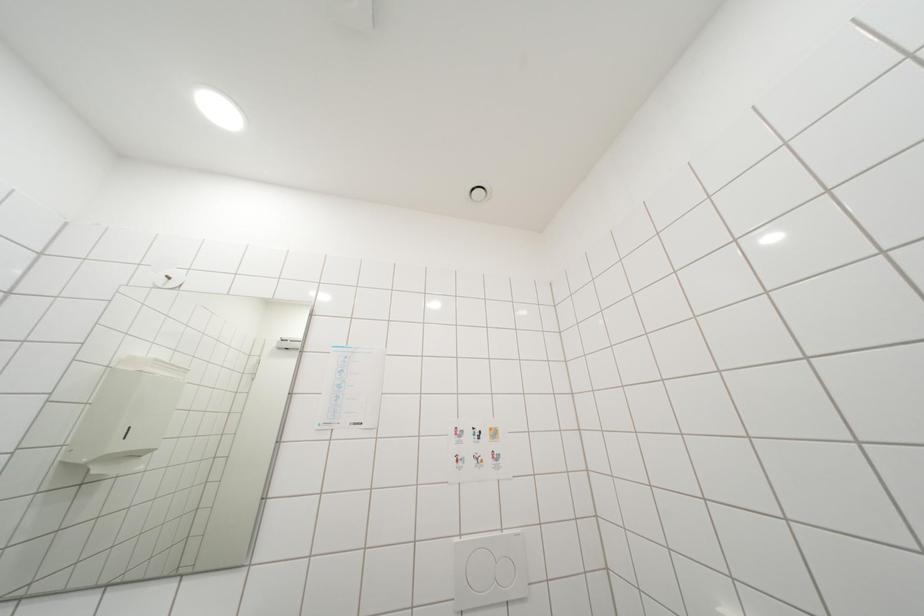
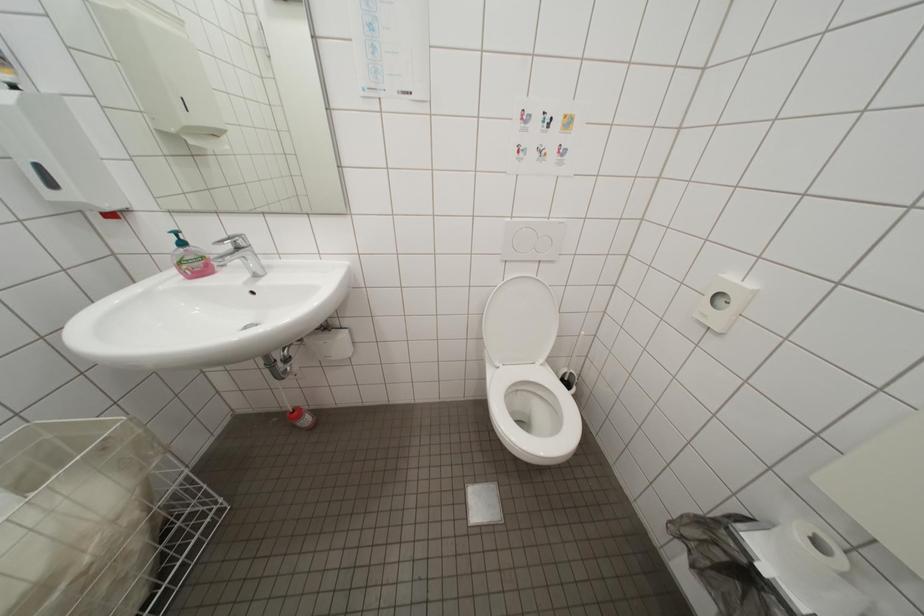
Question: The images are taken continuously from a first-person perspective. In which direction is your viewpoint rotating?

Choices:
 (A) Left
 (B) Right
 (C) Up
 (D) Down

Answer: (D)